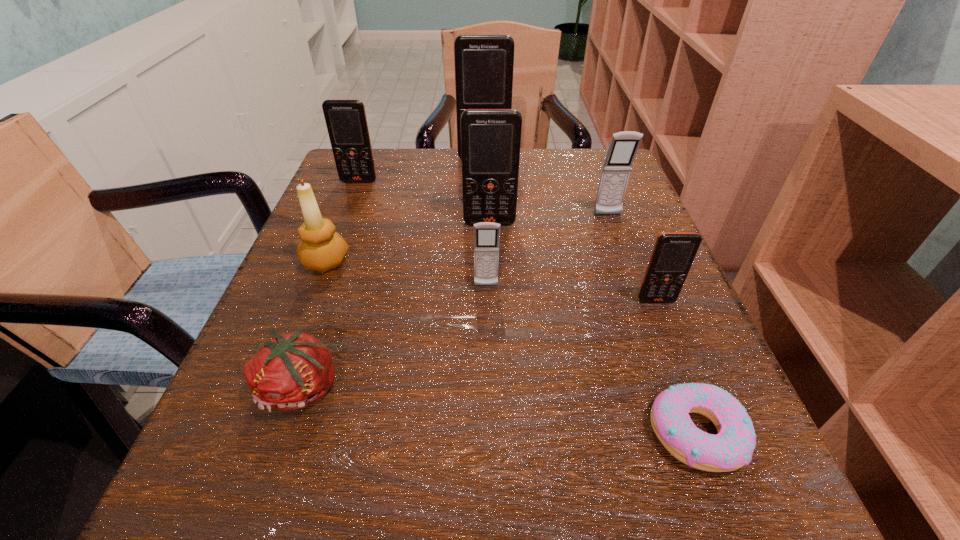
Identify the location of the nearest orange cellular telephone. The image size is (960, 540). (673, 254).

Find the location of a particular element. This screenshot has width=960, height=540. the left gray cellular telephone is located at coordinates (486, 234).

I want to click on the sixth farthest object, so click(x=486, y=234).

Locate an element on the screen. The width and height of the screenshot is (960, 540). the second shortest object is located at coordinates coord(293,370).

You are a GUI agent. You are given a task and a screenshot of the screen. Output one action in this format:
    pyautogui.click(x=<x>, y=<y>)
    Task: Click on the red tomato
    This screenshot has height=540, width=960.
    Given the screenshot: What is the action you would take?
    pyautogui.click(x=293, y=370)

You are a GUI agent. You are given a task and a screenshot of the screen. Output one action in this format:
    pyautogui.click(x=<x>, y=<y>)
    Task: Click on the doughnut
    The height and width of the screenshot is (540, 960).
    Given the screenshot: What is the action you would take?
    pyautogui.click(x=732, y=448)

At what (x,y) coordinates should I click in order to perform the action: click on vacant region located 0.080m on the screen of the biggest orange cellular telephone. Please return your answer as a coordinate pair (x, y). Looking at the image, I should click on (484, 180).

You are a GUI agent. You are given a task and a screenshot of the screen. Output one action in this format:
    pyautogui.click(x=<x>, y=<y>)
    Task: Click on the vacant space located on the screen of the fifth shortest cellular telephone
    This screenshot has width=960, height=540.
    Given the screenshot: What is the action you would take?
    pyautogui.click(x=493, y=382)

At what (x,y) coordinates should I click in order to perform the action: click on free location located 0.090m on the front-facing side of the third farthest cellular telephone. Please return your answer as a coordinate pair (x, y). The image size is (960, 540). Looking at the image, I should click on (619, 247).

At what (x,y) coordinates should I click in order to perform the action: click on vacant space located 0.080m on the screen of the second farthest orange cellular telephone. Please return your answer as a coordinate pair (x, y). This screenshot has height=540, width=960. Looking at the image, I should click on (350, 204).